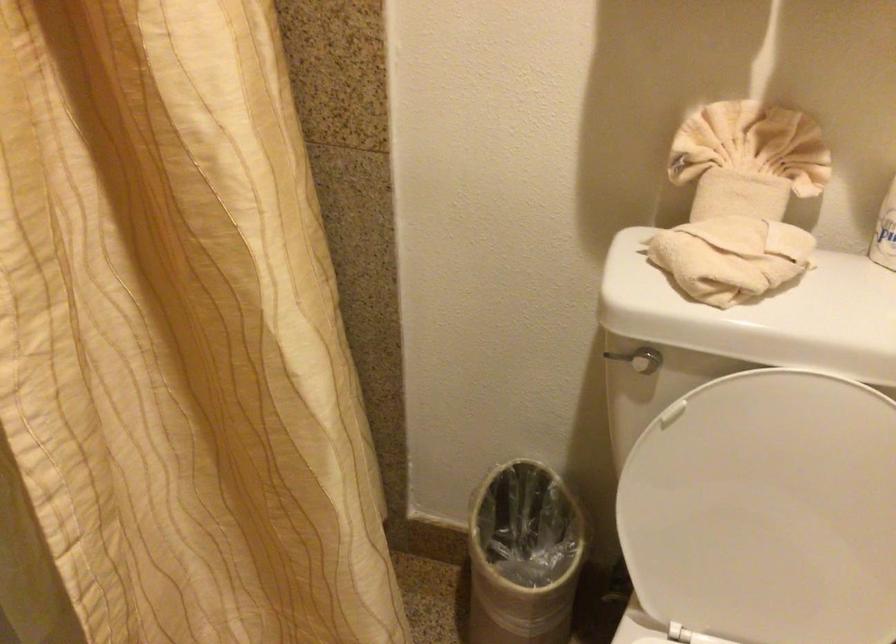
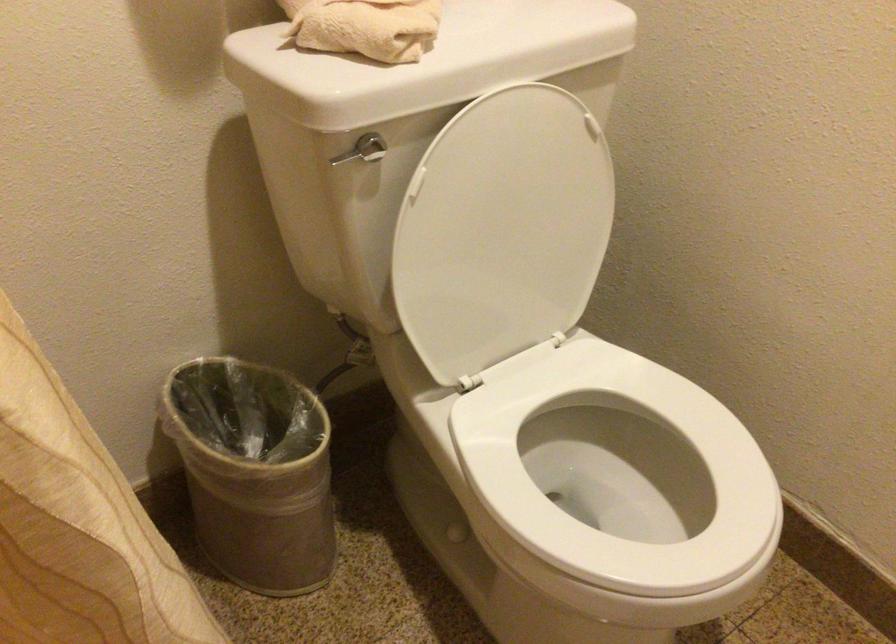
In the second image, find the point that corresponds to pixel 682 261 in the first image.

(365, 26)